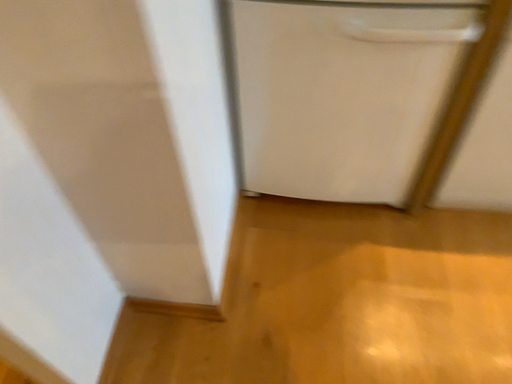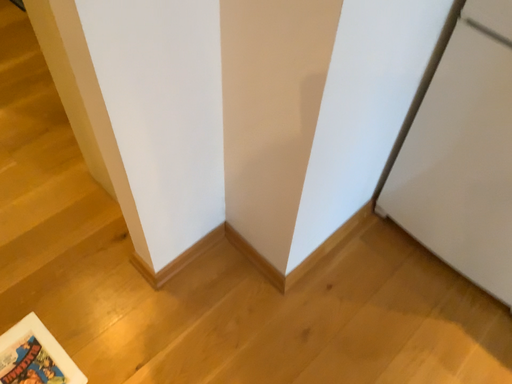
Question: How did the camera likely rotate when shooting the video?

Choices:
 (A) rotated right
 (B) rotated left

Answer: (B)